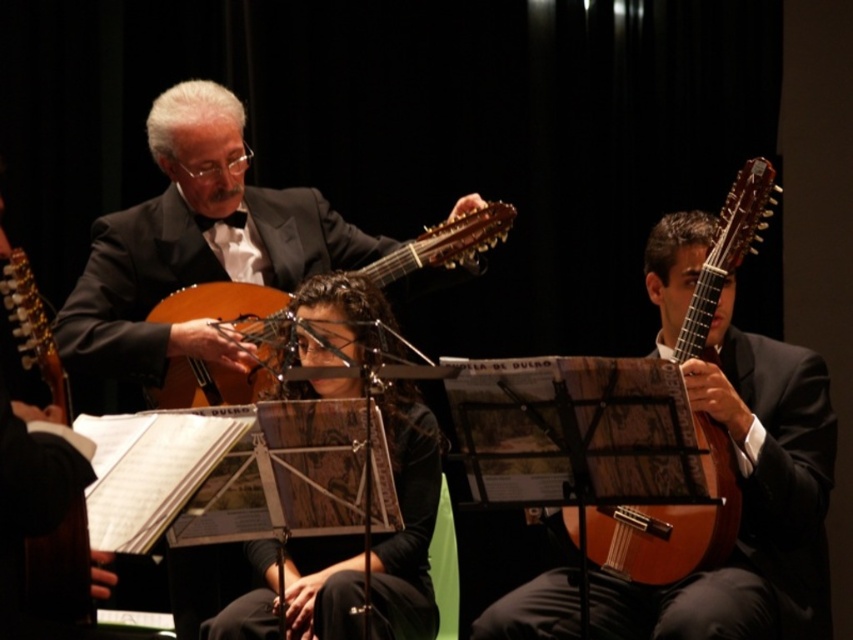
Question: Is shiny black suit at center positioned in front of wooden acoustic guitar at right?

Choices:
 (A) yes
 (B) no

Answer: (B)

Question: Which point is farther from the camera taking this photo?

Choices:
 (A) (260, 348)
 (B) (683, 312)
 (C) (149, 144)

Answer: (A)

Question: Can you confirm if shiny black suit at center is positioned below wooden acoustic guitar at right?

Choices:
 (A) yes
 (B) no

Answer: (B)

Question: Among these objects, which one is farthest from the camera?

Choices:
 (A) shiny black suit at center
 (B) wooden acoustic guitar at right

Answer: (A)

Question: Is shiny black suit at center to the left of wooden acoustic guitar at right from the viewer's perspective?

Choices:
 (A) no
 (B) yes

Answer: (B)

Question: Which point appears closest to the camera in this image?

Choices:
 (A) (206, 387)
 (B) (666, 518)

Answer: (B)